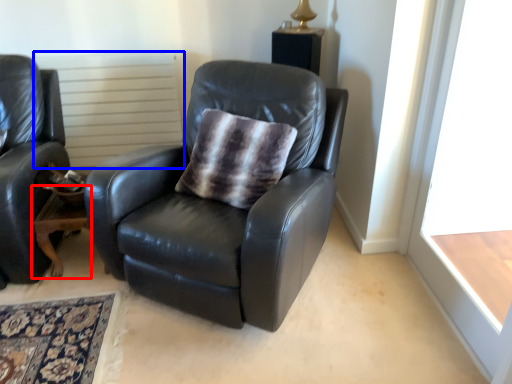
Question: Among these objects, which one is farthest to the camera, table (highlighted by a red box) or radiator (highlighted by a blue box)?

Choices:
 (A) table
 (B) radiator

Answer: (B)